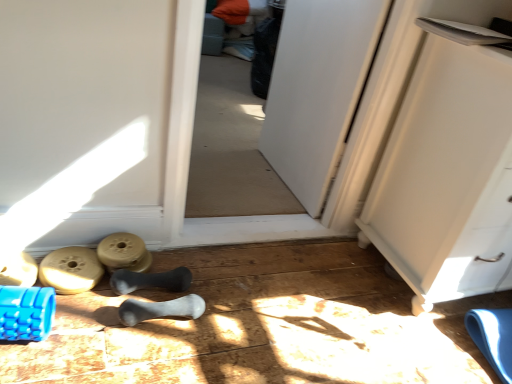
The height and width of the screenshot is (384, 512). In order to click on free space to the back side of gray rubber bone at center, arranged as the 4th footwear when viewed from the left in this screenshot , I will do `click(194, 273)`.